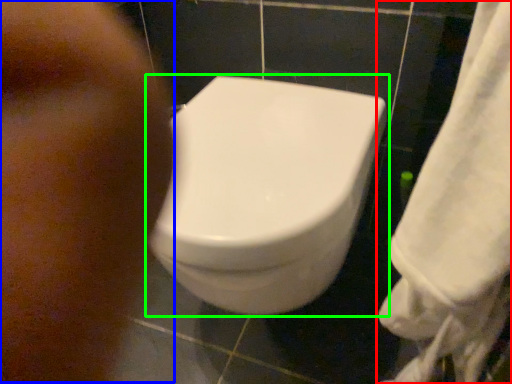
Question: Estimate the real-world distances between objects in this image. Which object is farther from towel (highlighted by a red box), face (highlighted by a blue box) or toilet (highlighted by a green box)?

Choices:
 (A) face
 (B) toilet

Answer: (A)